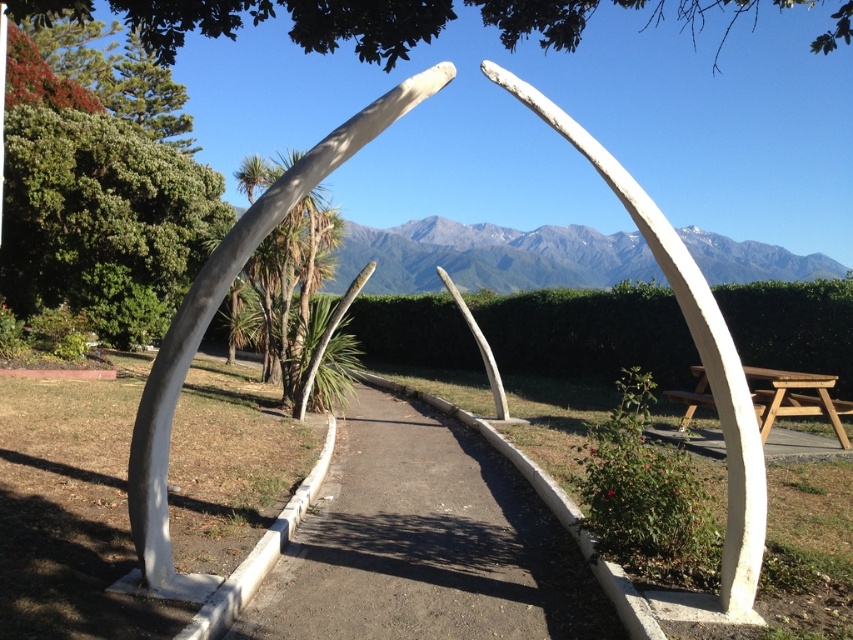
You are planning to place a new bench along the white concrete path at center. Considering the space it occupies, will the bench fit better near the wooden picnic table at right or along the path itself?

The bench will fit better near the wooden picnic table at right because the white concrete path at center occupies less space than the wooden picnic table at right, providing more room there.

You are planning to place a small potted plant between the white polished bone at center and the wooden picnic table at right. Based on their sizes, which object should the plant be closer to?

The white polished bone at center has a smaller size compared to the wooden picnic table at right, so the plant should be placed closer to the white polished bone at center to maintain visual balance.